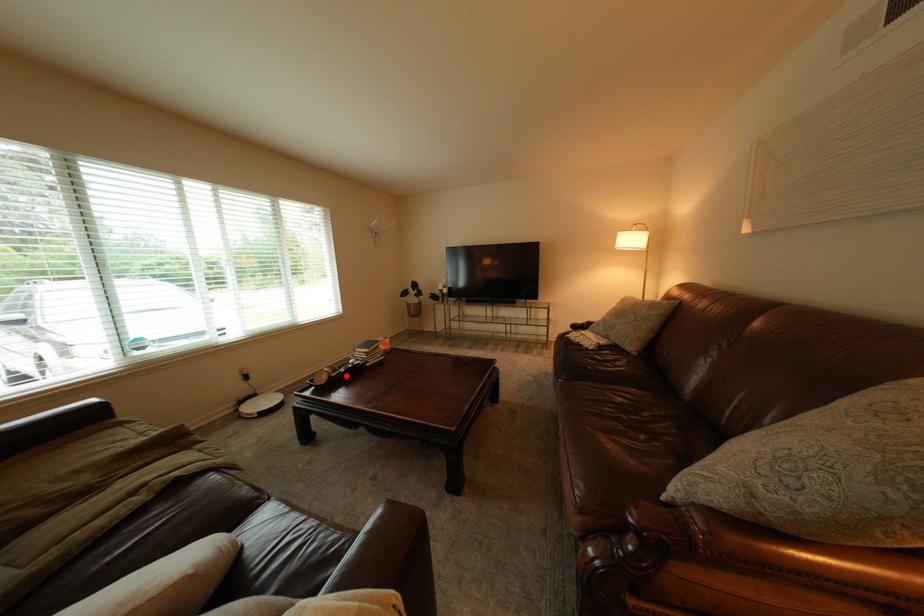
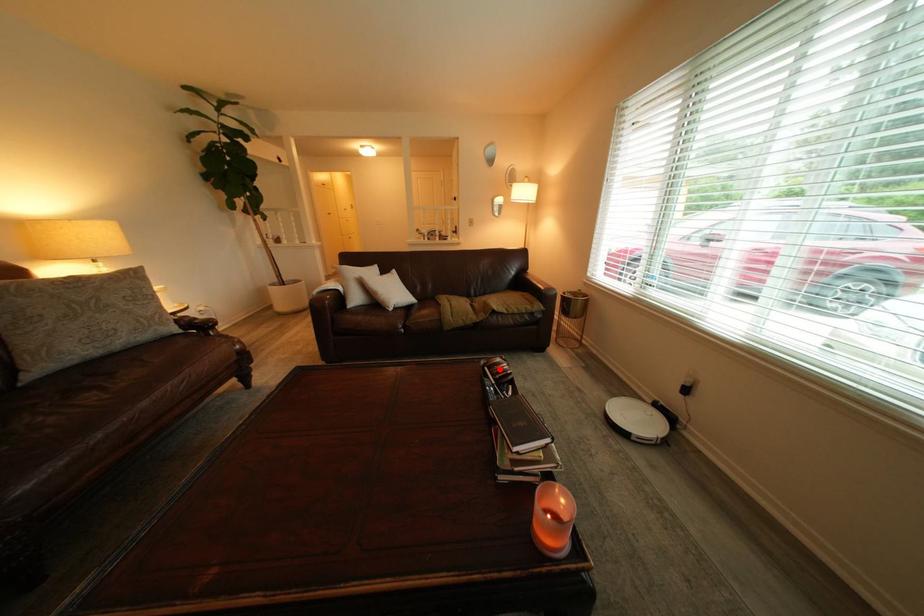
I am providing you with two images of the same scene from different viewpoints. A red point is marked on the first image and another point is marked on the second image. Does the point marked in image1 correspond to the same location as the one in image2?

Yes